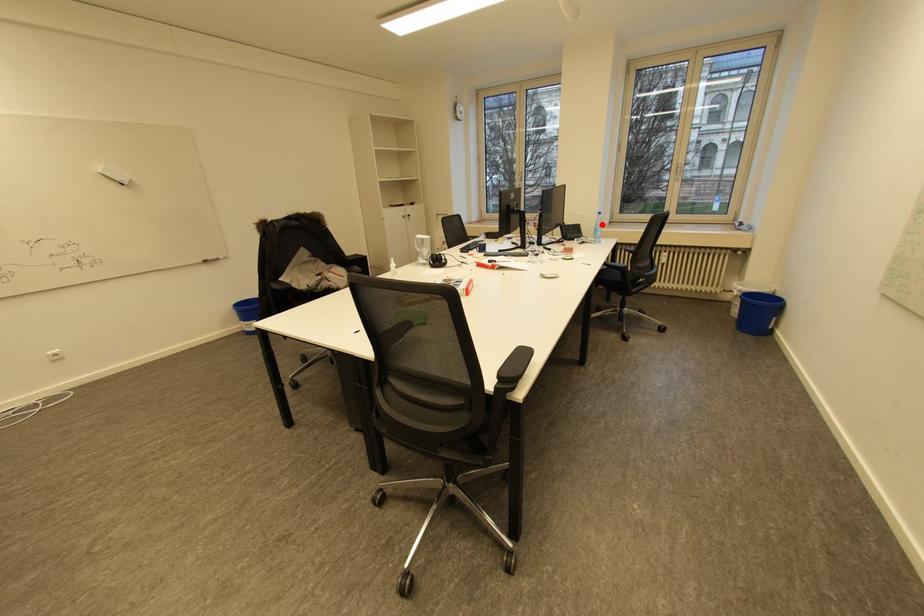
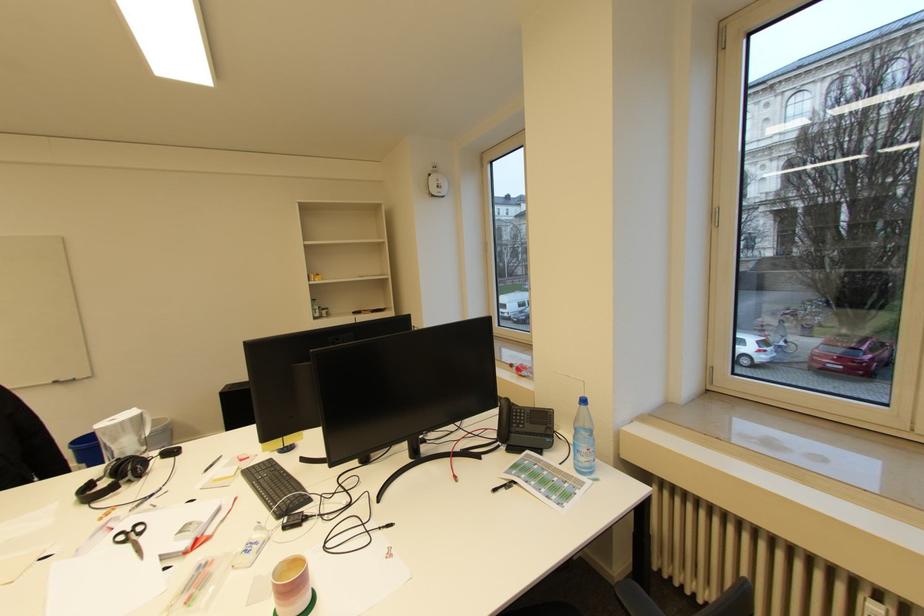
Find the pixel in the second image that matches the highlighted location in the first image.

(581, 429)